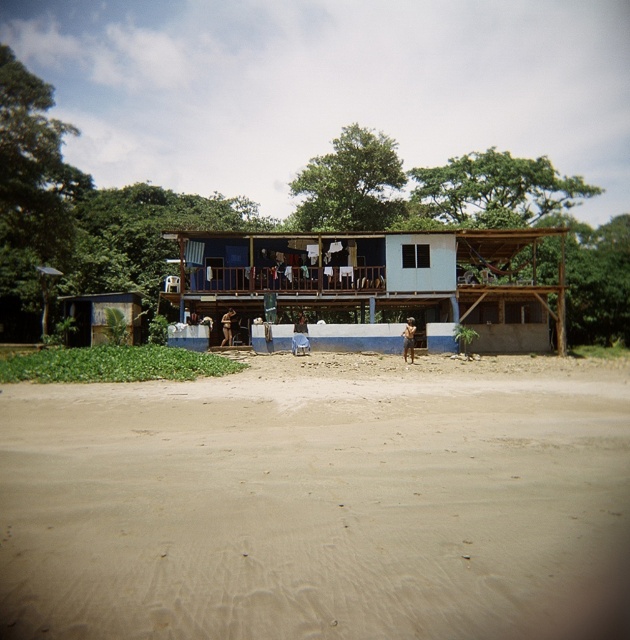
You are standing at the beachside and looking at the wooden structure. There are two points marked on the image, point A at coordinates point (33,556) and point B at coordinates point (442,307). Which point is closer to you?

Point point (33,556) is closer to the camera than point point (442,307), so point A is closer to you.

You are a visitor standing on the beige sandy beach at lower center and want to reach the blue painted wood at center. Which direction should you move to get there?

You should move upward from the beige sandy beach at lower center to reach the blue painted wood at center since the blue painted wood at center is positioned above the beige sandy beach at lower center.